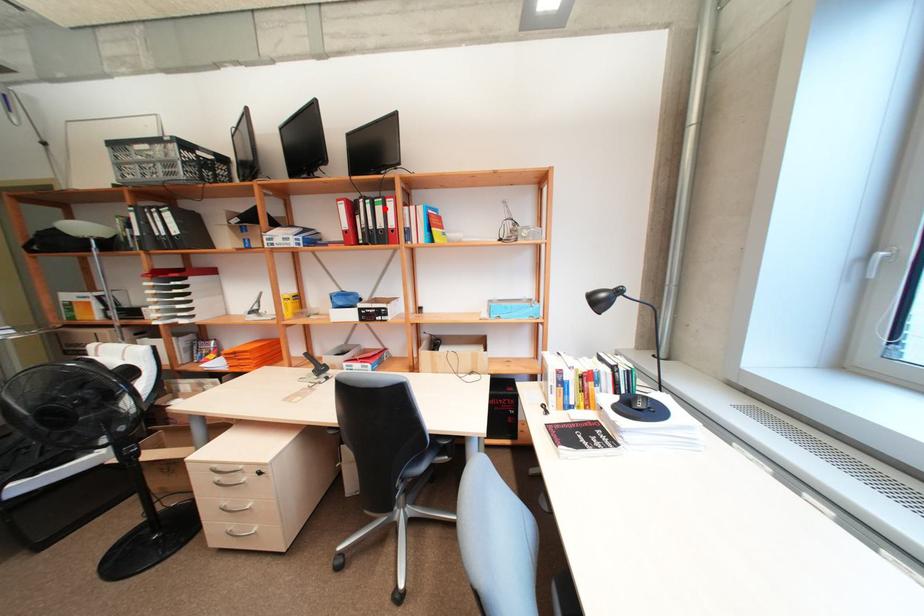
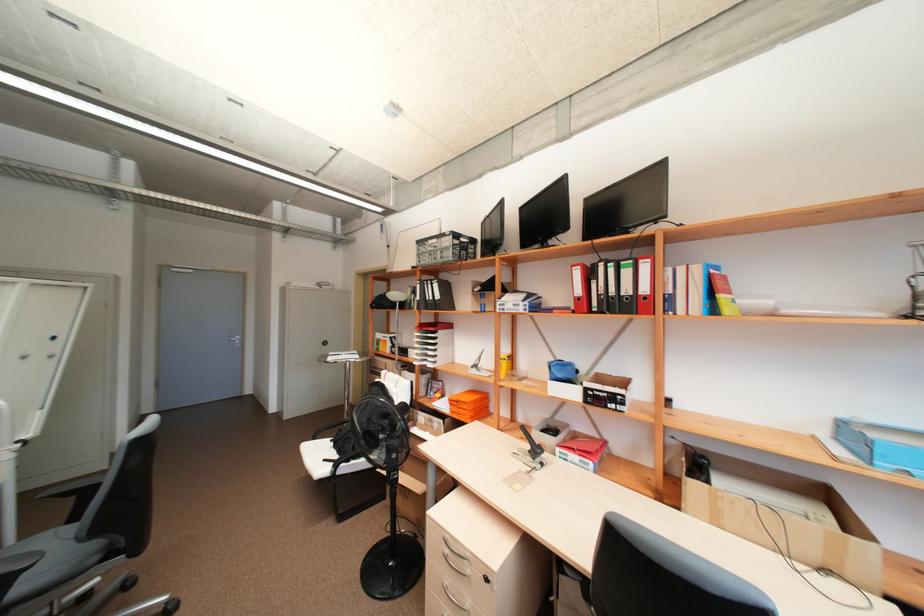
The point at the highlighted location is marked in the first image. Where is the corresponding point in the second image?

(633, 273)